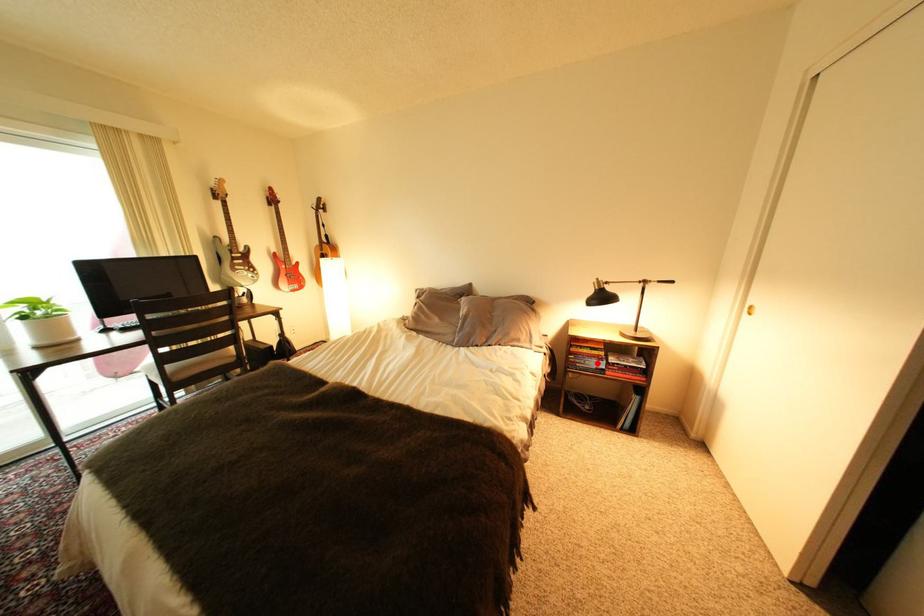
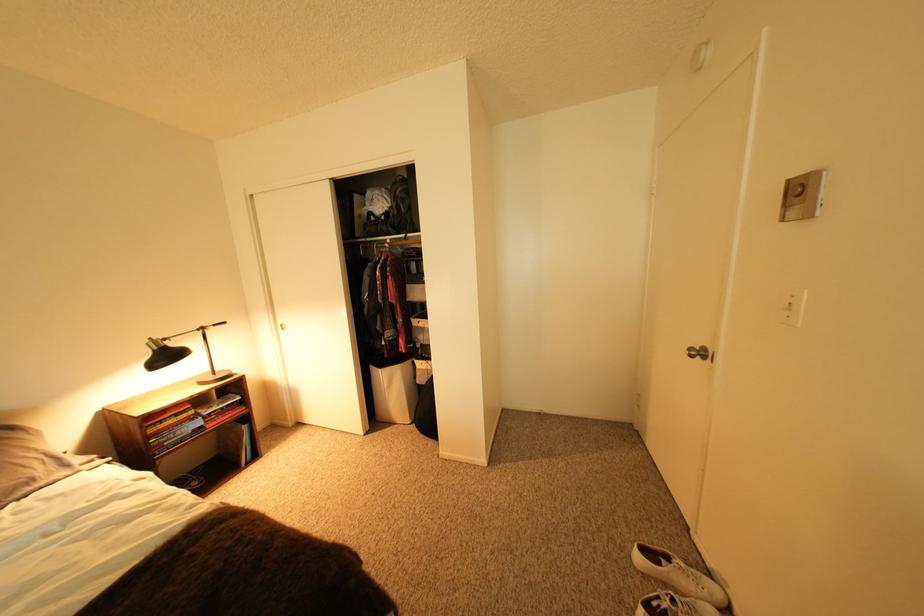
Question: I am providing you with two images of the same scene from different viewpoints. Image1 has a red point marked. In image2, the corresponding 3D location appears at what relative position? Reply with the corresponding letter.

Choices:
 (A) Closer
 (B) Farther

Answer: (A)